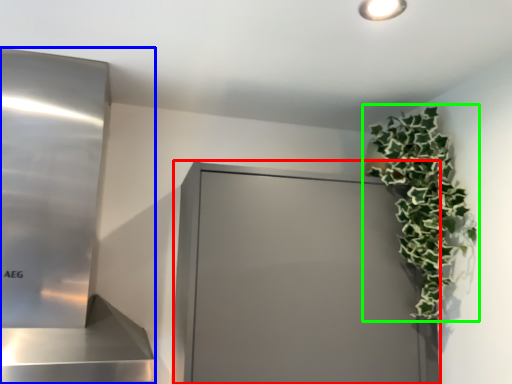
Question: Based on their relative distances, which object is nearer to glass door (highlighted by a red box)? Choose from appliance (highlighted by a blue box) and houseplant (highlighted by a green box).

Choices:
 (A) appliance
 (B) houseplant

Answer: (B)